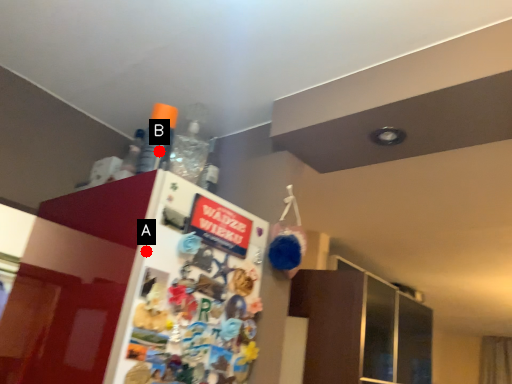
Question: Two points are circled on the image, labeled by A and B beside each circle. Which of the following is the closest to the observer?

Choices:
 (A) A is closer
 (B) B is closer

Answer: (A)